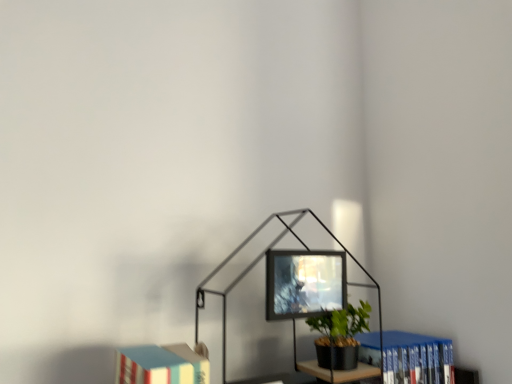
Question: Considering the relative positions of blue hardcover book at lower right, the 1th book from the right, and hardcover book at lower left, which appears as the second book when viewed from the back, in the image provided, is blue hardcover book at lower right, the 1th book from the right, to the left of hardcover book at lower left, which appears as the second book when viewed from the back, from the viewer's perspective?

Choices:
 (A) no
 (B) yes

Answer: (A)

Question: Is blue hardcover book at lower right, positioned as the second book in front-to-back order, facing away from hardcover book at lower left, which appears as the second book when viewed from the back?

Choices:
 (A) no
 (B) yes

Answer: (A)

Question: Is blue hardcover book at lower right, positioned as the second book in front-to-back order, outside hardcover book at lower left, which appears as the second book when viewed from the back?

Choices:
 (A) yes
 (B) no

Answer: (A)

Question: Is blue hardcover book at lower right, positioned as the second book in front-to-back order, behind hardcover book at lower left, which is the first book in front-to-back order?

Choices:
 (A) yes
 (B) no

Answer: (A)

Question: From the image's perspective, is blue hardcover book at lower right, positioned as the second book in front-to-back order, above hardcover book at lower left, which ranks as the 1th book in left-to-right order?

Choices:
 (A) yes
 (B) no

Answer: (B)

Question: From a real-world perspective, relative to blue hardcover book at lower right, the first book viewed from the back, is hardcover book at lower left, which appears as the second book when viewed from the back, vertically above or below?

Choices:
 (A) below
 (B) above

Answer: (B)

Question: In the image, is hardcover book at lower left, which ranks as the 1th book in left-to-right order, positioned in front of or behind blue hardcover book at lower right, the first book viewed from the back?

Choices:
 (A) front
 (B) behind

Answer: (A)

Question: Would you say hardcover book at lower left, which is the first book in front-to-back order, is to the left or to the right of blue hardcover book at lower right, positioned as the 2th book in left-to-right order, in the picture?

Choices:
 (A) right
 (B) left

Answer: (B)

Question: Is point (179, 369) positioned closer to the camera than point (378, 354)?

Choices:
 (A) closer
 (B) farther

Answer: (A)

Question: Considering the positions of hardcover book at lower left, which ranks as the second book in right-to-left order, and matte black monitor at center in the image, is hardcover book at lower left, which ranks as the second book in right-to-left order, bigger or smaller than matte black monitor at center?

Choices:
 (A) big
 (B) small

Answer: (A)

Question: Looking at their shapes, would you say hardcover book at lower left, which ranks as the 1th book in left-to-right order, is wider or thinner than matte black monitor at center?

Choices:
 (A) wide
 (B) thin

Answer: (A)

Question: Considering the positions of hardcover book at lower left, which ranks as the second book in right-to-left order, and matte black monitor at center in the image, is hardcover book at lower left, which ranks as the second book in right-to-left order, taller or shorter than matte black monitor at center?

Choices:
 (A) short
 (B) tall

Answer: (B)

Question: Relative to matte black monitor at center, is hardcover book at lower left, which ranks as the second book in right-to-left order, in front or behind?

Choices:
 (A) front
 (B) behind

Answer: (A)

Question: Is metallic black table lamp at center to the left or to the right of hardcover book at lower left, which appears as the second book when viewed from the back, in the image?

Choices:
 (A) left
 (B) right

Answer: (B)

Question: Would you say metallic black table lamp at center is inside or outside hardcover book at lower left, which ranks as the second book in right-to-left order?

Choices:
 (A) outside
 (B) inside

Answer: (A)